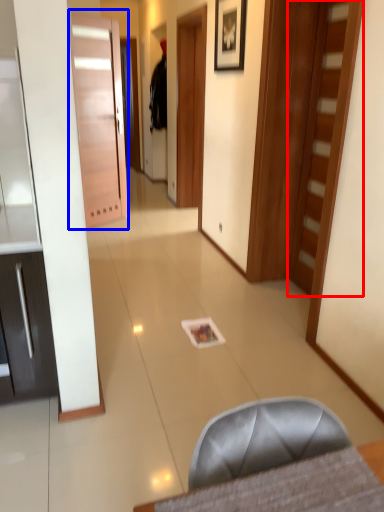
Question: Among these objects, which one is farthest to the camera, door (highlighted by a red box) or door (highlighted by a blue box)?

Choices:
 (A) door
 (B) door

Answer: (B)